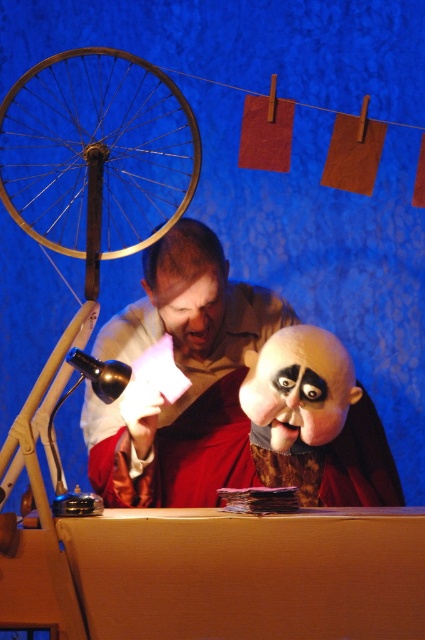
What do you see at coordinates (186, 374) in the screenshot? The image size is (425, 640). I see `matte white shirt at center` at bounding box center [186, 374].

Who is positioned more to the right, matte white shirt at center or gold metallic bicycle wheel at left?

From the viewer's perspective, matte white shirt at center appears more on the right side.

Between point (280, 324) and point (76, 90), which one is positioned in front?

Point (280, 324)

Where is `matte white shirt at center`? This screenshot has width=425, height=640. matte white shirt at center is located at coordinates (186, 374).